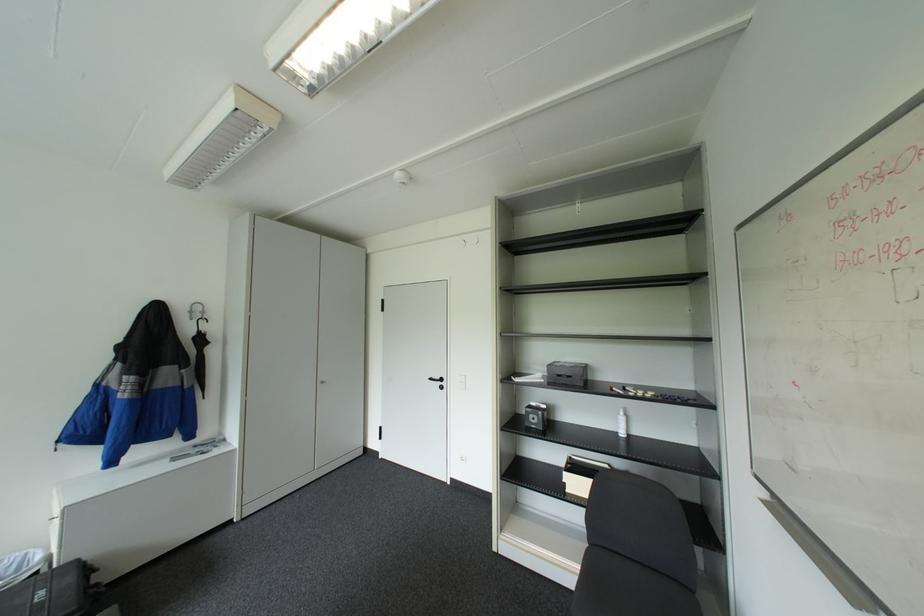
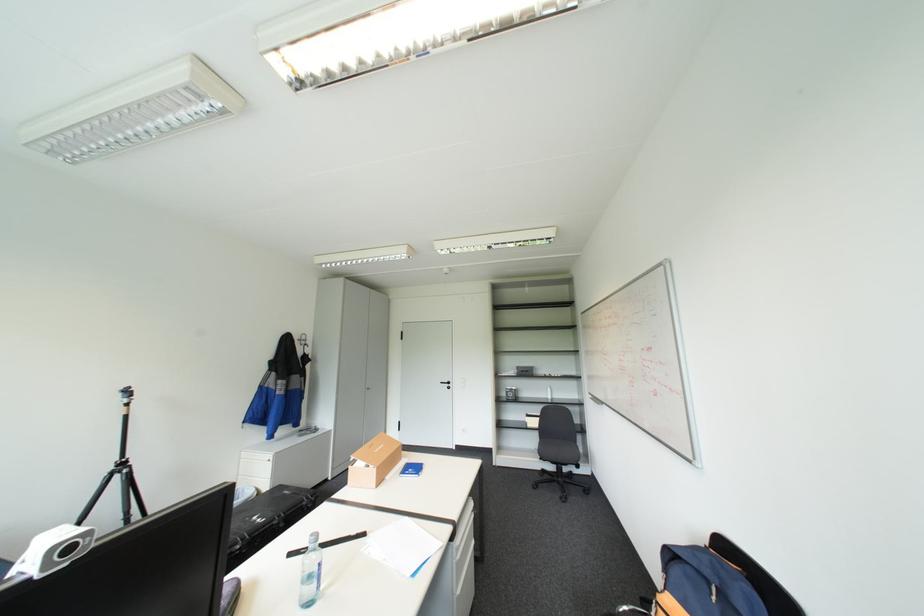
Find the pixel in the second image that matches [439,378] in the first image.

(450, 381)